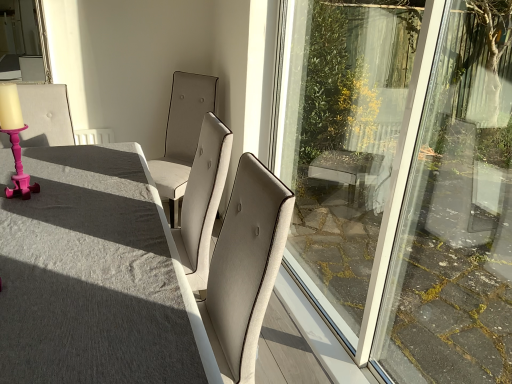
You are a GUI agent. You are given a task and a screenshot of the screen. Output one action in this format:
    pyautogui.click(x=<x>, y=<y>)
    Task: Click on the vacant area that is situated to the right of pink wood candle holder at left
    This screenshot has height=384, width=512.
    Given the screenshot: What is the action you would take?
    pyautogui.click(x=63, y=197)